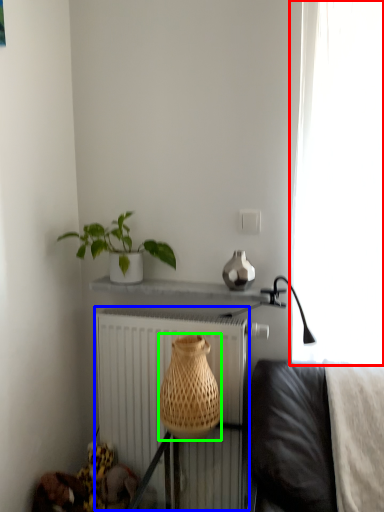
Question: Which object is positioned closest to curtain (highlighted by a red box)? Select from radiator (highlighted by a blue box) and basket (highlighted by a green box).

Choices:
 (A) radiator
 (B) basket

Answer: (B)